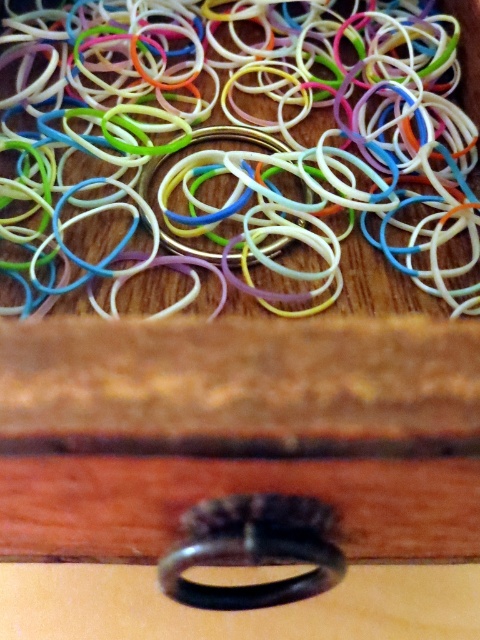
Is rubber band at center above black rubber band at center?

Indeed, rubber band at center is positioned over black rubber band at center.

Is rubber band at center positioned in front of black rubber band at center?

No, it is not.

Where is `rubber band at center`? The width and height of the screenshot is (480, 640). rubber band at center is located at coordinates (233, 150).

Find the location of a particular element. The height and width of the screenshot is (640, 480). rubber band at center is located at coordinates (233, 150).